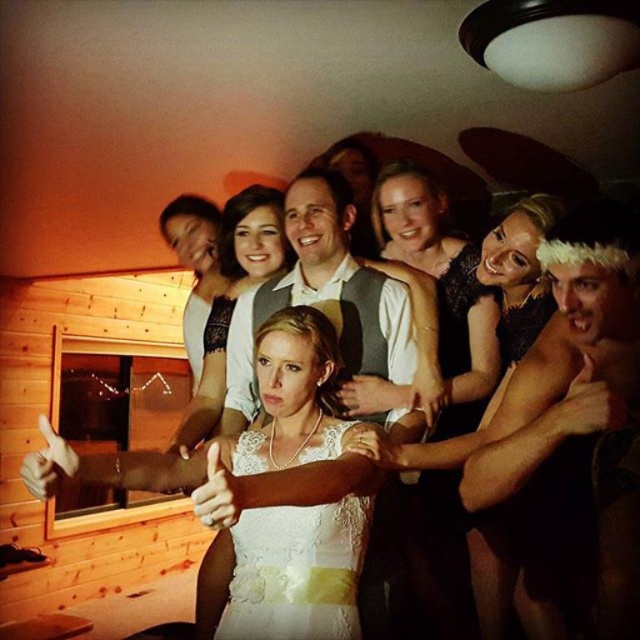
Question: Which object is positioned closest to the white lace dress at center?

Choices:
 (A) satin black dress at center
 (B) shiny gold chain at upper center
 (C) white textured shirt at center

Answer: (C)

Question: Does shiny gold chain at upper center have a smaller size compared to white textured shirt at center?

Choices:
 (A) no
 (B) yes

Answer: (A)

Question: Estimate the real-world distances between objects in this image. Which object is farther from the white textured shirt at center?

Choices:
 (A) shiny gold chain at upper center
 (B) satin black dress at center
 (C) white lace dress at center

Answer: (A)

Question: Observing the image, what is the correct spatial positioning of shiny gold chain at upper center in reference to satin black dress at center?

Choices:
 (A) right
 (B) left

Answer: (A)

Question: Which of these objects is positioned closest to the white textured shirt at center?

Choices:
 (A) shiny gold chain at upper center
 (B) white lace dress at center

Answer: (B)

Question: Is satin black dress at center below white textured shirt at center?

Choices:
 (A) yes
 (B) no

Answer: (A)